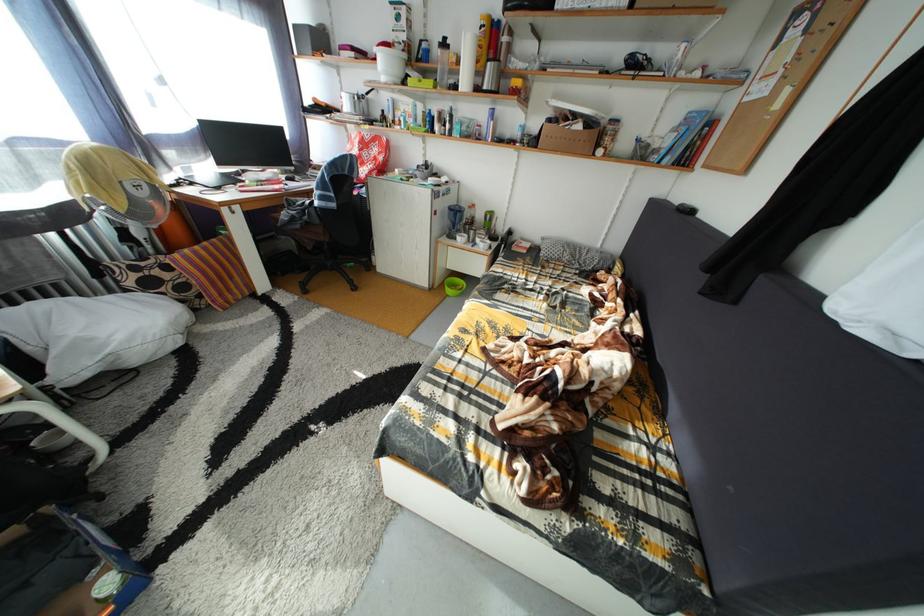
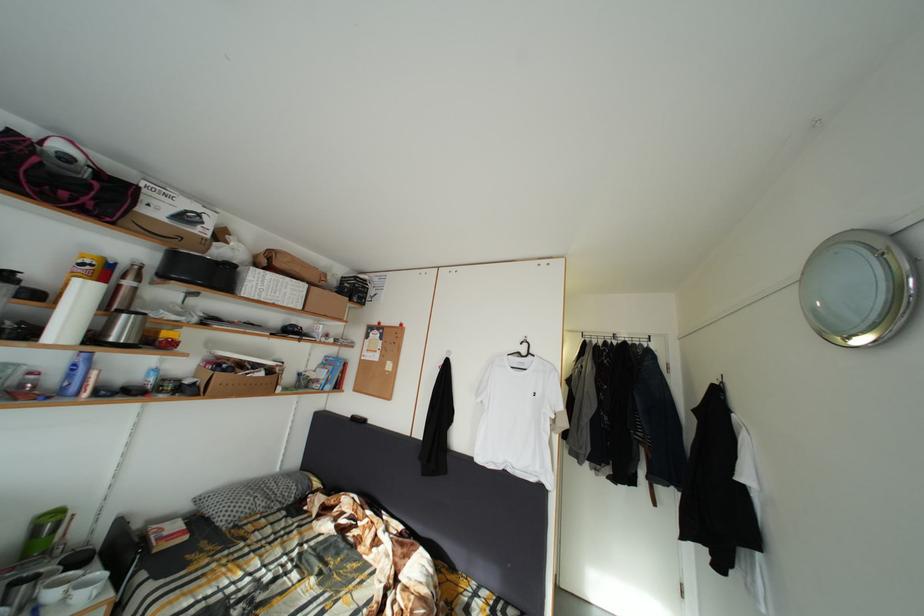
Find the pixel in the second image that matches the point at 585,123 in the first image.

(264, 373)